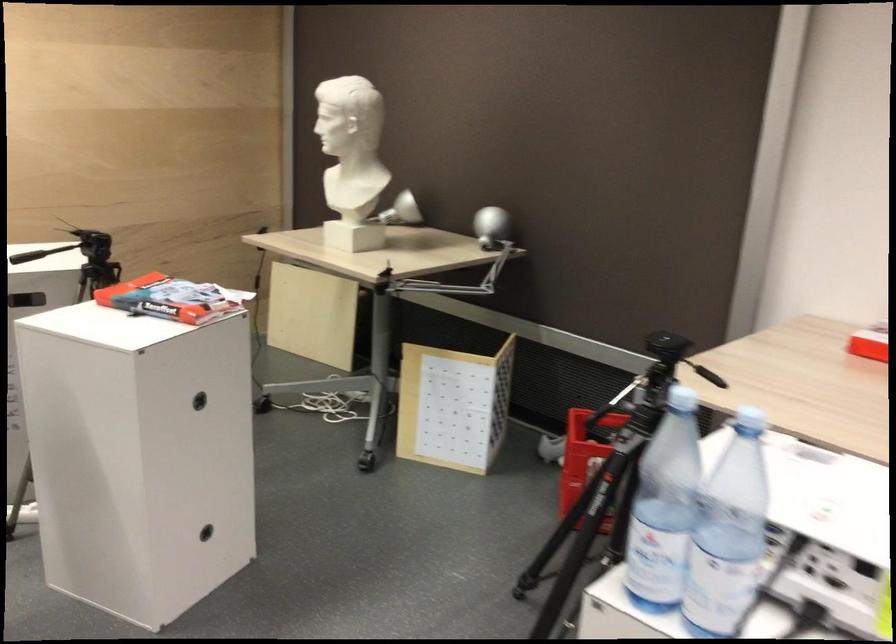
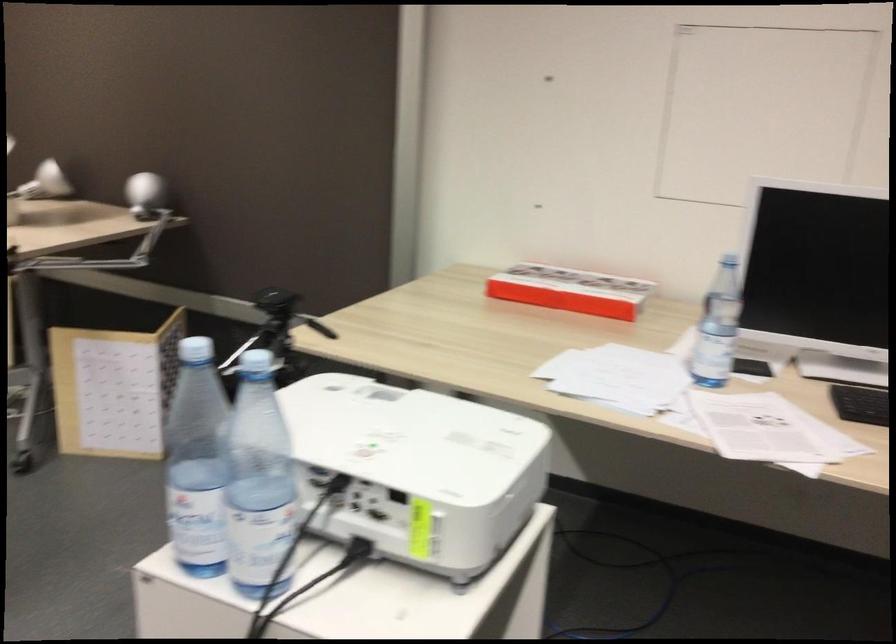
Question: I am providing you with two images of the same scene from different viewpoints. Which of the following objects are not visible in image2?

Choices:
 (A) red cardboard box
 (B) tripod adjustment handle
 (C) projector lens ring
 (D) none of these

Answer: (D)